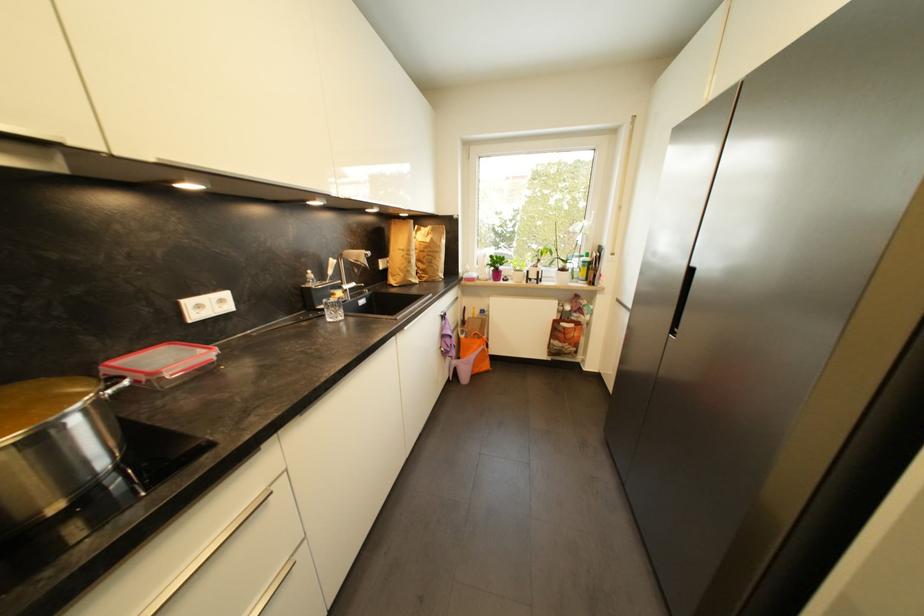
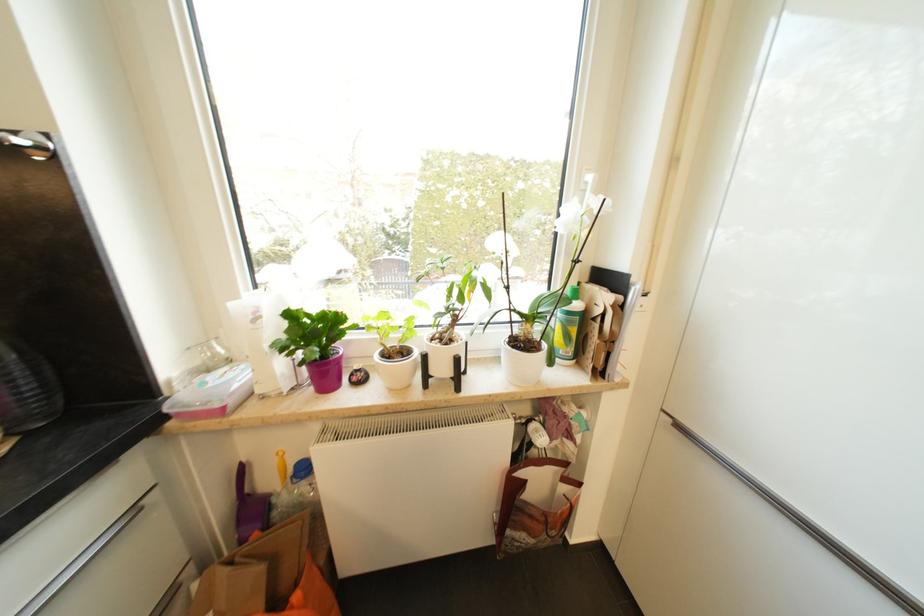
Question: In a continuous first-person perspective shot, in which direction is the camera moving?

Choices:
 (A) Left
 (B) Right
 (C) Forward
 (D) Backward

Answer: (C)